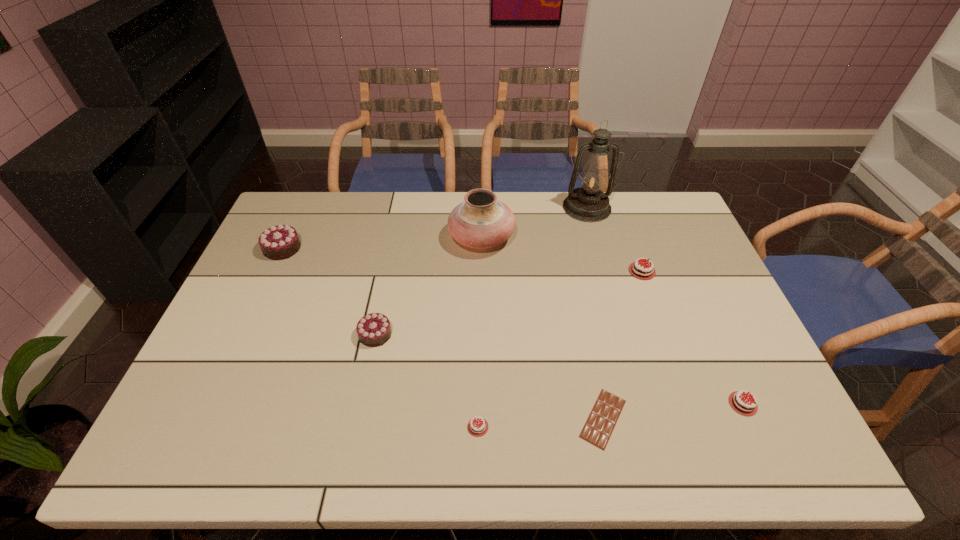
Where is `the smallest red chocolate cake`? The width and height of the screenshot is (960, 540). the smallest red chocolate cake is located at coordinates (477, 427).

Find the location of `the shortest chocolate cake`. the shortest chocolate cake is located at coordinates (477, 427).

Find the location of `the shortest object`. the shortest object is located at coordinates (604, 415).

Locate an element on the screen. The height and width of the screenshot is (540, 960). chocolate bar is located at coordinates point(604,415).

What are the coordinates of `vacant region located 0.360m on the left of the oil lamp` in the screenshot? It's located at (464, 207).

Identify the location of vacant area situated 0.060m on the left of the second tallest object. This screenshot has height=540, width=960. (431, 238).

Where is `vacant space located on the front of the left chocolate chocolate cake`? This screenshot has height=540, width=960. vacant space located on the front of the left chocolate chocolate cake is located at coordinates (272, 272).

The height and width of the screenshot is (540, 960). Find the location of `free space located 0.300m on the front of the right chocolate chocolate cake`. free space located 0.300m on the front of the right chocolate chocolate cake is located at coordinates (349, 461).

Where is `free space located 0.050m on the right of the fourth shortest object`? free space located 0.050m on the right of the fourth shortest object is located at coordinates pos(686,271).

Where is `vacant position located 0.200m on the left of the second shortest chocolate cake`? vacant position located 0.200m on the left of the second shortest chocolate cake is located at coordinates (631, 404).